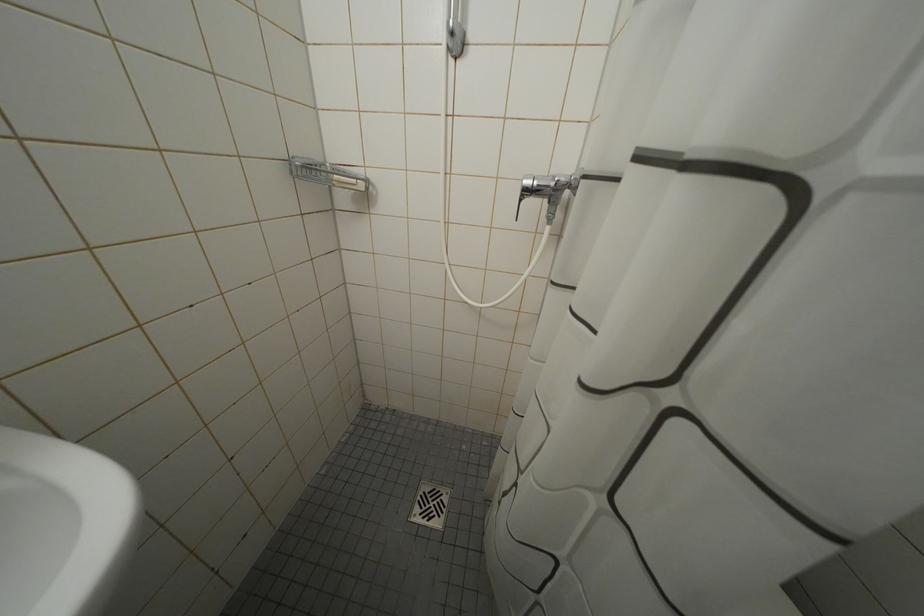
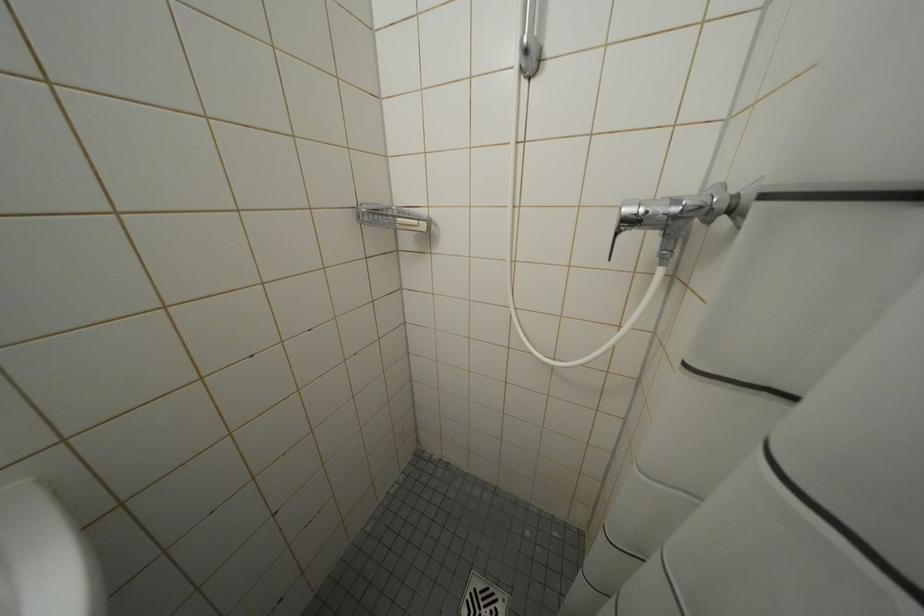
Question: The camera is either moving clockwise (left) or counter-clockwise (right) around the object. The first image is from the beginning of the video and the second image is from the end. Is the camera moving left or right when shooting the video?

Choices:
 (A) Left
 (B) Right

Answer: (B)